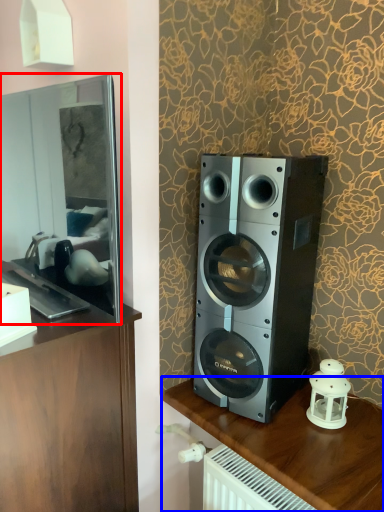
Question: Which object appears closest to the camera in this image, mirror (highlighted by a red box) or furniture (highlighted by a blue box)?

Choices:
 (A) mirror
 (B) furniture

Answer: (A)